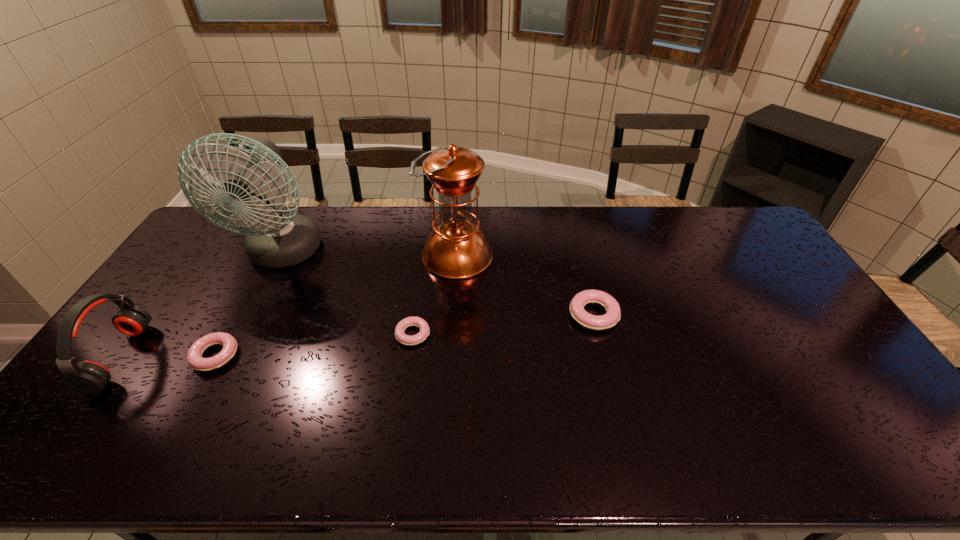
Find the location of `vacant space located 0.210m on the left of the second shortest doughnut`. vacant space located 0.210m on the left of the second shortest doughnut is located at coordinates (117, 356).

Identify the location of free spot located 0.330m on the left of the second doughnut from right to left. Image resolution: width=960 pixels, height=540 pixels. (281, 334).

The height and width of the screenshot is (540, 960). In order to click on free space located 0.240m on the back of the fourth tallest object in this screenshot , I will do `click(577, 248)`.

I want to click on free space located in front of the fan where the airflow is directed, so click(233, 351).

At what (x,y) coordinates should I click in order to perform the action: click on vacant area located on the ear cups of the third tallest object. Please return your answer as a coordinate pair (x, y). This screenshot has width=960, height=540. Looking at the image, I should click on (226, 357).

Locate an element on the screen. vacant position located 0.100m on the right of the oil lamp is located at coordinates (522, 256).

I want to click on fan that is at the far edge, so click(x=276, y=239).

Find the location of a particular element. The height and width of the screenshot is (540, 960). oil lamp that is at the far edge is located at coordinates (456, 249).

Locate an element on the screen. object present at the near edge is located at coordinates (88, 377).

Identify the location of object located at the left edge. The height and width of the screenshot is (540, 960). (88, 377).